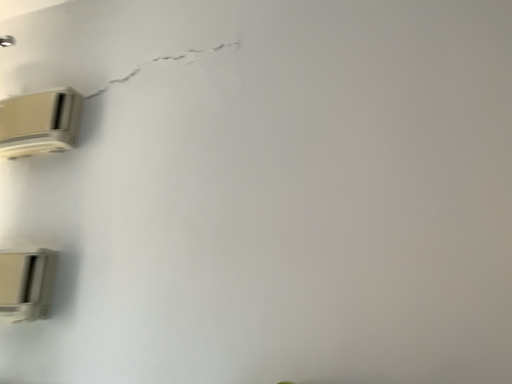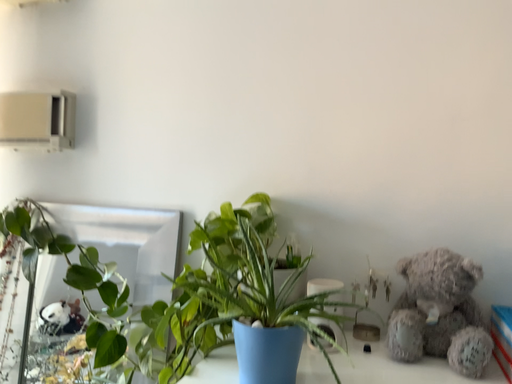
Question: How did the camera likely rotate when shooting the video?

Choices:
 (A) rotated upward
 (B) rotated downward

Answer: (B)